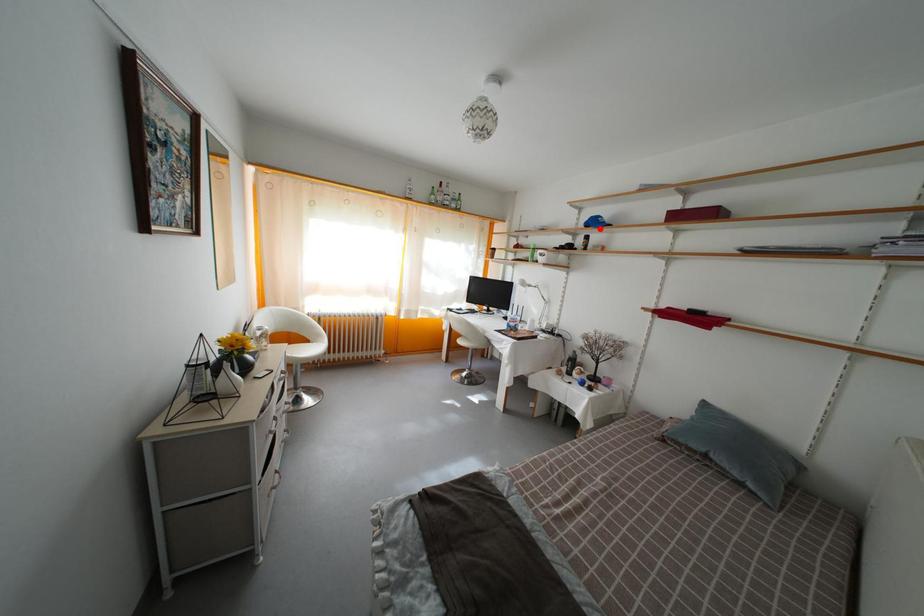
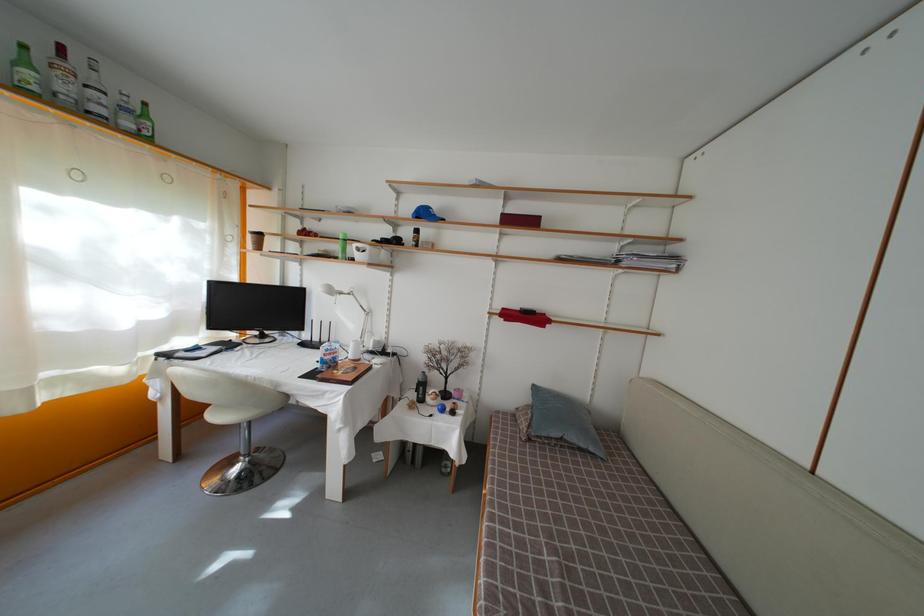
Where in the second image is the point corresponding to the highlighted location from the first image?

(430, 220)